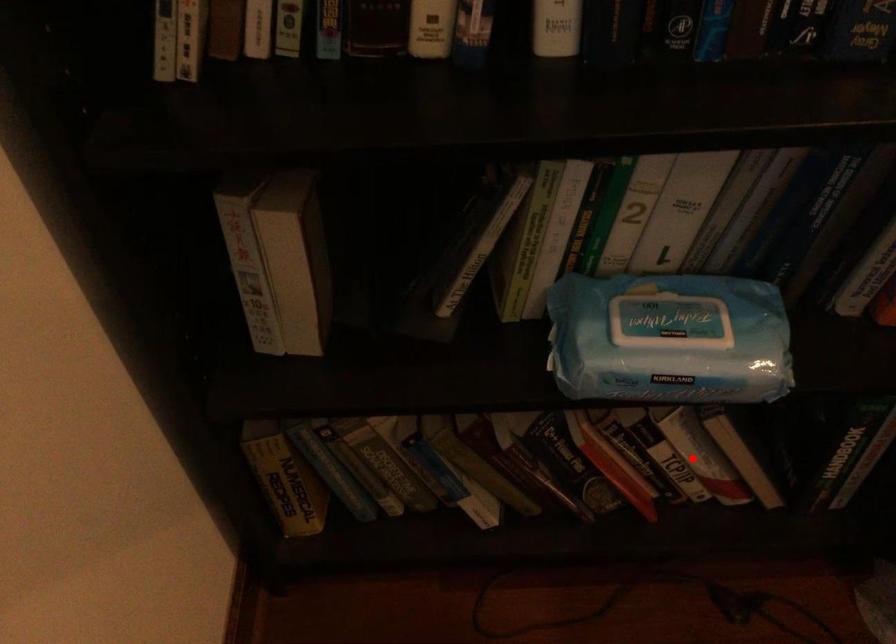
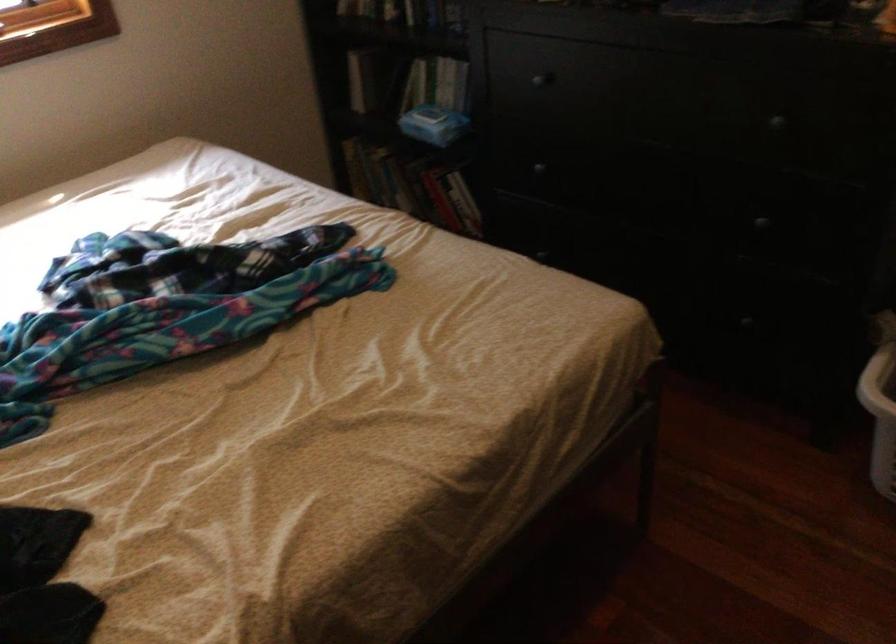
Find the pixel in the second image that matches the highlighted location in the first image.

(464, 203)